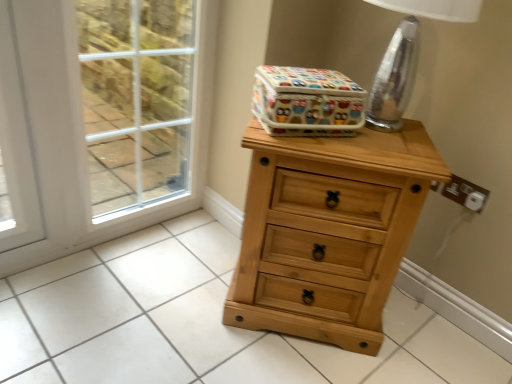
What do you see at coordinates (101, 119) in the screenshot?
I see `transparent glass screen door at left` at bounding box center [101, 119].

Identify the location of colorful fabric storage box at upper center. Image resolution: width=512 pixels, height=384 pixels. (307, 102).

The width and height of the screenshot is (512, 384). What do you see at coordinates (465, 193) in the screenshot?
I see `white plastic electric outlet at right` at bounding box center [465, 193].

This screenshot has height=384, width=512. What are the coordinates of `clear glass table lamp at upper right` in the screenshot? It's located at click(x=407, y=56).

Where is `transparent glass screen door at left`? The height and width of the screenshot is (384, 512). transparent glass screen door at left is located at coordinates (101, 119).

Is colorful fabric storage box at upper center wider or thinner than transparent glass screen door at left?

Considering their sizes, colorful fabric storage box at upper center looks broader than transparent glass screen door at left.

Could you tell me if colorful fabric storage box at upper center is facing transparent glass screen door at left?

No, colorful fabric storage box at upper center is not oriented towards transparent glass screen door at left.

From the image's perspective, would you say colorful fabric storage box at upper center is shown under transparent glass screen door at left?

Actually, colorful fabric storage box at upper center appears above transparent glass screen door at left in the image.

In order to click on screen door below the colorful fabric storage box at upper center (from the image's perspective) in this screenshot , I will do `click(101, 119)`.

Is point (368, 109) closer to viewer compared to point (325, 105)?

No.

Is clear glass table lamp at upper right far away from colorful fabric storage box at upper center?

clear glass table lamp at upper right is actually quite close to colorful fabric storage box at upper center.

Does clear glass table lamp at upper right have a larger size compared to colorful fabric storage box at upper center?

Yes, clear glass table lamp at upper right is bigger than colorful fabric storage box at upper center.

Is clear glass table lamp at upper right positioned with its back to colorful fabric storage box at upper center?

That's not correct — clear glass table lamp at upper right is not looking away from colorful fabric storage box at upper center.

In the scene shown: Is transparent glass screen door at left to the left of clear glass table lamp at upper right from the viewer's perspective?

Yes, transparent glass screen door at left is to the left of clear glass table lamp at upper right.

Considering their positions, is transparent glass screen door at left located in front of or behind clear glass table lamp at upper right?

Visually, transparent glass screen door at left is located behind clear glass table lamp at upper right.

Is transparent glass screen door at left facing towards clear glass table lamp at upper right?

Yes, transparent glass screen door at left faces towards clear glass table lamp at upper right.

Measure the distance from transparent glass screen door at left to clear glass table lamp at upper right.

transparent glass screen door at left is 94.31 centimeters away from clear glass table lamp at upper right.

Is transparent glass screen door at left shorter than white plastic electric outlet at right?

Incorrect, the height of transparent glass screen door at left does not fall short of that of white plastic electric outlet at right.

Are transparent glass screen door at left and white plastic electric outlet at right located far from each other?

Yes.

Considering the sizes of objects transparent glass screen door at left and white plastic electric outlet at right in the image provided, who is thinner, transparent glass screen door at left or white plastic electric outlet at right?

white plastic electric outlet at right.

Image resolution: width=512 pixels, height=384 pixels. What are the coordinates of `screen door lying in front of the white plastic electric outlet at right` in the screenshot? It's located at (101, 119).

From the image's perspective, is white plastic electric outlet at right on top of clear glass table lamp at upper right?

Incorrect, from the image's perspective, white plastic electric outlet at right is lower than clear glass table lamp at upper right.

Does white plastic electric outlet at right have a greater width compared to clear glass table lamp at upper right?

No.

Are white plastic electric outlet at right and clear glass table lamp at upper right making contact?

white plastic electric outlet at right and clear glass table lamp at upper right are not in contact.

Considering the positions of objects white plastic electric outlet at right and clear glass table lamp at upper right in the image provided, who is in front, white plastic electric outlet at right or clear glass table lamp at upper right?

Positioned in front is clear glass table lamp at upper right.

Find the location of a particular element. The height and width of the screenshot is (384, 512). storage box on the left of white plastic electric outlet at right is located at coordinates (307, 102).

From a real-world perspective, who is located higher, white plastic electric outlet at right or colorful fabric storage box at upper center?

colorful fabric storage box at upper center, from a real-world perspective.

Is white plastic electric outlet at right inside the boundaries of colorful fabric storage box at upper center, or outside?

The correct answer is: outside.

Is white plastic electric outlet at right at the right side of colorful fabric storage box at upper center?

Yes, white plastic electric outlet at right is to the right of colorful fabric storage box at upper center.

What's the angular difference between natural wood chest of drawers at center and transparent glass screen door at left's facing directions?

There is a 50.6-degree angle between the facing directions of natural wood chest of drawers at center and transparent glass screen door at left.

Considering the relative positions of natural wood chest of drawers at center and transparent glass screen door at left in the image provided, is natural wood chest of drawers at center to the left of transparent glass screen door at left from the viewer's perspective?

No, natural wood chest of drawers at center is not to the left of transparent glass screen door at left.

Considering the positions of points (355, 304) and (176, 80), is point (355, 304) closer to camera compared to point (176, 80)?

Yes, it is in front of point (176, 80).

Is natural wood chest of drawers at center oriented away from transparent glass screen door at left?

No.

The width and height of the screenshot is (512, 384). What are the coordinates of `screen door that is behind the colorful fabric storage box at upper center` in the screenshot? It's located at (101, 119).

This screenshot has width=512, height=384. I want to click on table lamp above the colorful fabric storage box at upper center (from the image's perspective), so click(x=407, y=56).

Which object lies nearer to the anchor point colorful fabric storage box at upper center, clear glass table lamp at upper right or natural wood chest of drawers at center?

Among the two, clear glass table lamp at upper right is located nearer to colorful fabric storage box at upper center.

Estimate the real-world distances between objects in this image. Which object is further from natural wood chest of drawers at center, clear glass table lamp at upper right or white plastic electric outlet at right?

white plastic electric outlet at right.

Considering their positions, is colorful fabric storage box at upper center positioned closer to transparent glass screen door at left than natural wood chest of drawers at center?

colorful fabric storage box at upper center lies closer to transparent glass screen door at left than the other object.

Looking at the image, which one is located further to clear glass table lamp at upper right, transparent glass screen door at left or natural wood chest of drawers at center?

transparent glass screen door at left is further to clear glass table lamp at upper right.

Which object lies further to the anchor point transparent glass screen door at left, white plastic electric outlet at right or colorful fabric storage box at upper center?

white plastic electric outlet at right.

Estimate the real-world distances between objects in this image. Which object is further from colorful fabric storage box at upper center, clear glass table lamp at upper right or transparent glass screen door at left?

The object further to colorful fabric storage box at upper center is transparent glass screen door at left.

Estimate the real-world distances between objects in this image. Which object is further from transparent glass screen door at left, white plastic electric outlet at right or natural wood chest of drawers at center?

Based on the image, white plastic electric outlet at right appears to be further to transparent glass screen door at left.

Based on the photo, which object lies nearer to the anchor point colorful fabric storage box at upper center, natural wood chest of drawers at center or clear glass table lamp at upper right?

clear glass table lamp at upper right is closer to colorful fabric storage box at upper center.

You are a GUI agent. You are given a task and a screenshot of the screen. Output one action in this format:
    pyautogui.click(x=<x>, y=<y>)
    Task: Click on the storage box situated between transparent glass screen door at left and clear glass table lamp at upper right from left to right
    
    Given the screenshot: What is the action you would take?
    pyautogui.click(x=307, y=102)

Identify the location of chest of drawers between transparent glass screen door at left and clear glass table lamp at upper right in the horizontal direction. (328, 231).

This screenshot has width=512, height=384. In order to click on storage box situated between transparent glass screen door at left and white plastic electric outlet at right from left to right in this screenshot , I will do [x=307, y=102].

What are the coordinates of `the chest of drawers situated between transparent glass screen door at left and white plastic electric outlet at right from left to right` in the screenshot? It's located at (328, 231).